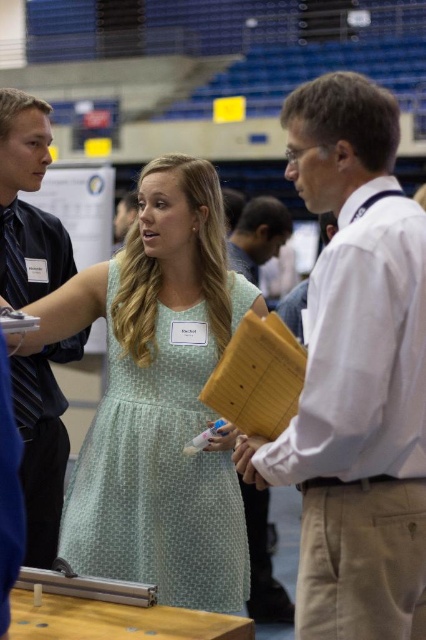
You are standing at the back of the gymnasium and see the white shirt at center and the dark blue shirt at left. Which shirt is closer to you?

The white shirt at center is closer to the viewer than the dark blue shirt at left.

You are an event coordinator at the conference. You need to guide a speaker to the stage, which is behind the light green polka dot dress at center. The speaker is currently standing near the dark blue shirt at left. Can the speaker walk directly towards the stage without moving around any obstacles?

The light green polka dot dress at center is located below the dark blue shirt at left, meaning the dress is positioned lower in the image. Since the stage is behind the dress, the speaker can walk straight down from the dark blue shirt at left towards the lower area where the dress is, leading to the stage without needing to go around obstacles.

You are organizing a group photo and need to arrange the white shirt at center and dark blue shirt at left side by side. Based on their sizes, which one should be placed on the left to avoid overcrowding the frame?

The white shirt at center should be placed on the left since it is wider than the dark blue shirt at left, allowing for better spacing between them without overcrowding the frame.